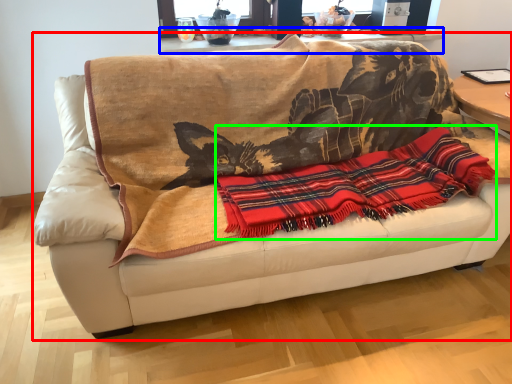
Question: Estimate the real-world distances between objects in this image. Which object is closer to studio couch (highlighted by a red box), table (highlighted by a blue box) or cloth (highlighted by a green box)?

Choices:
 (A) table
 (B) cloth

Answer: (B)